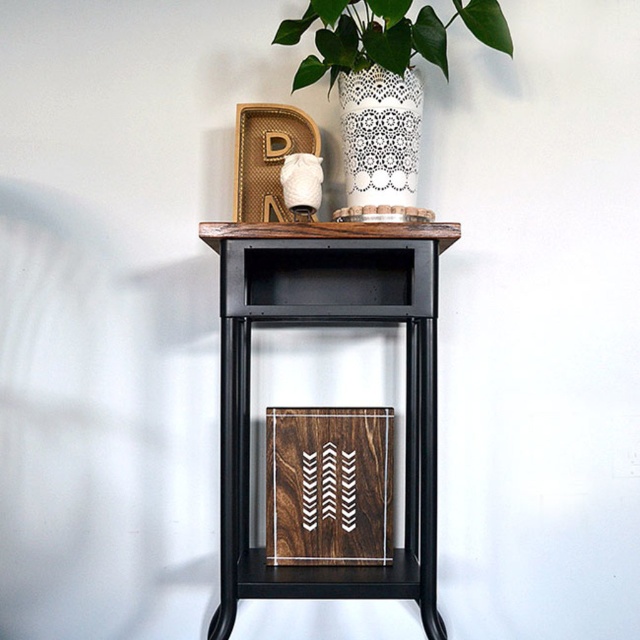
Question: Based on their relative distances, which object is nearer to the white lace vase at upper center?

Choices:
 (A) wooden cutting board at center
 (B) white lace glass vase at upper center

Answer: (B)

Question: Does wooden cutting board at center appear over white lace glass vase at upper center?

Choices:
 (A) no
 (B) yes

Answer: (A)

Question: Among these objects, which one is nearest to the camera?

Choices:
 (A) white lace glass vase at upper center
 (B) wooden cutting board at center
 (C) white lace vase at upper center

Answer: (C)

Question: From the image, what is the correct spatial relationship of wooden cutting board at center in relation to white lace glass vase at upper center?

Choices:
 (A) right
 (B) left

Answer: (B)

Question: Which object is the closest to the white lace vase at upper center?

Choices:
 (A) wooden cutting board at center
 (B) white lace glass vase at upper center

Answer: (B)

Question: Does white lace vase at upper center have a lesser width compared to white lace glass vase at upper center?

Choices:
 (A) yes
 (B) no

Answer: (B)